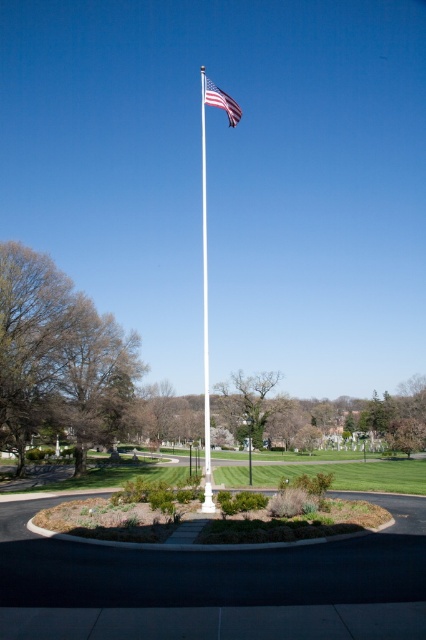
Question: Is green grass at center smaller than white glossy flagpole at center?

Choices:
 (A) no
 (B) yes

Answer: (B)

Question: Is white glossy flagpole at center further to the viewer compared to american flag at center?

Choices:
 (A) no
 (B) yes

Answer: (A)

Question: Which point is farther to the camera?

Choices:
 (A) (204, 500)
 (B) (209, 80)
 (C) (219, 476)

Answer: (B)

Question: Among these objects, which one is nearest to the camera?

Choices:
 (A) american flag at center
 (B) green grass at center

Answer: (A)

Question: Where is white glossy flagpole at center located in relation to american flag at center in the image?

Choices:
 (A) above
 (B) below

Answer: (B)

Question: Estimate the real-world distances between objects in this image. Which object is farther from the american flag at center?

Choices:
 (A) white glossy flagpole at center
 (B) green grass at center

Answer: (B)